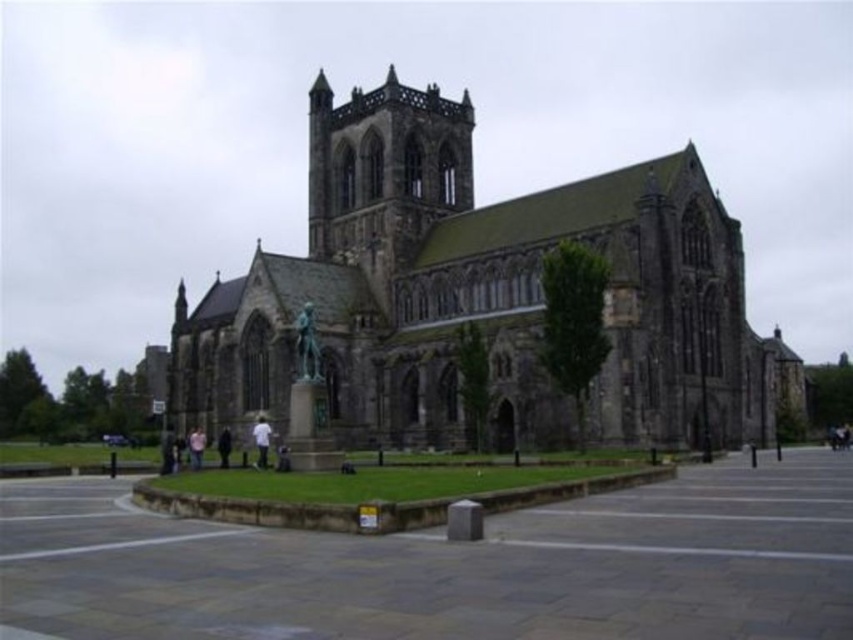
Question: Which is farther from the light brown leather jacket at lower center?

Choices:
 (A) smooth stone plaza at center
 (B) light brown leather jacket at lower left
 (C) white fabric shirt at center

Answer: (A)

Question: Among these points, which one is farthest from the camera?

Choices:
 (A) (595, 611)
 (B) (258, 419)
 (C) (170, 442)
 (D) (456, 280)

Answer: (D)

Question: Among these points, which one is nearest to the camera?

Choices:
 (A) (352, 604)
 (B) (300, 314)

Answer: (A)

Question: Does dark gray stone church at center come behind light brown leather jacket at lower left?

Choices:
 (A) no
 (B) yes

Answer: (A)

Question: Observing the image, what is the correct spatial positioning of bronze statue at center in reference to white fabric shirt at center?

Choices:
 (A) left
 (B) right

Answer: (B)

Question: Is dark gray stone church at center positioned behind light brown leather jacket at lower left?

Choices:
 (A) yes
 (B) no

Answer: (B)